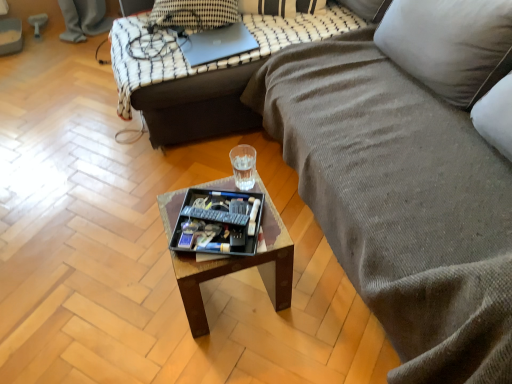
The width and height of the screenshot is (512, 384). In order to click on free spot above wooden tray at center (from a real-world perspective) in this screenshot , I will do `click(212, 226)`.